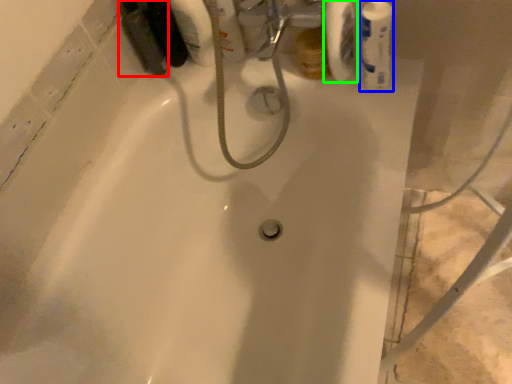
Question: Which object is the closest to the mouthwash (highlighted by a red box)? Choose among these: mouthwash (highlighted by a blue box) or toilet paper (highlighted by a green box).

Choices:
 (A) mouthwash
 (B) toilet paper

Answer: (B)